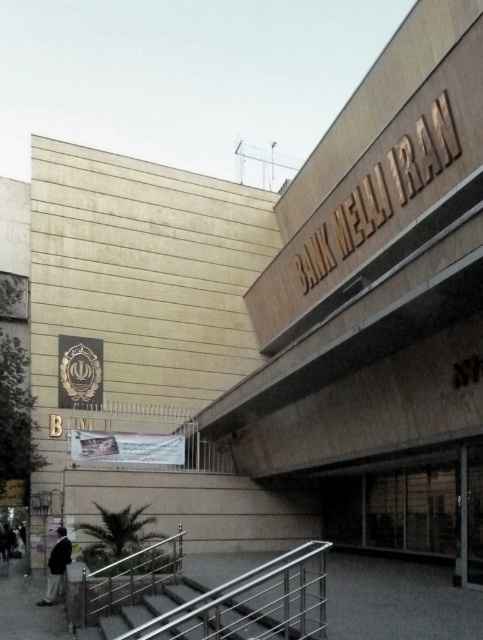
You are standing at the entrance of the building and see the stainless steel stairs at center and the dark gray suit at lower left. Which object is positioned higher from the ground?

The stainless steel stairs at center is above dark gray suit at lower left, so it is positioned higher from the ground.